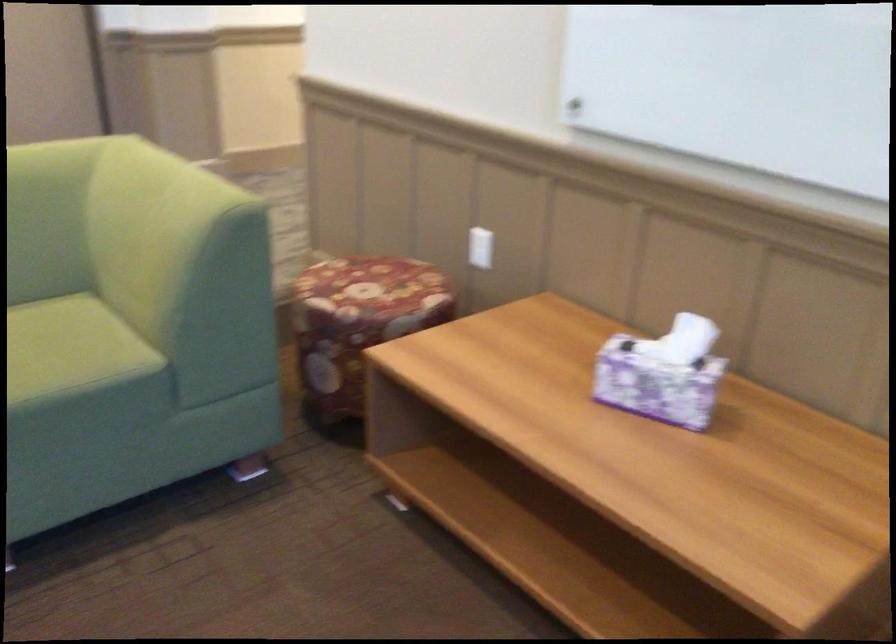
Locate an element on the screen. white light switch is located at coordinates (479, 247).